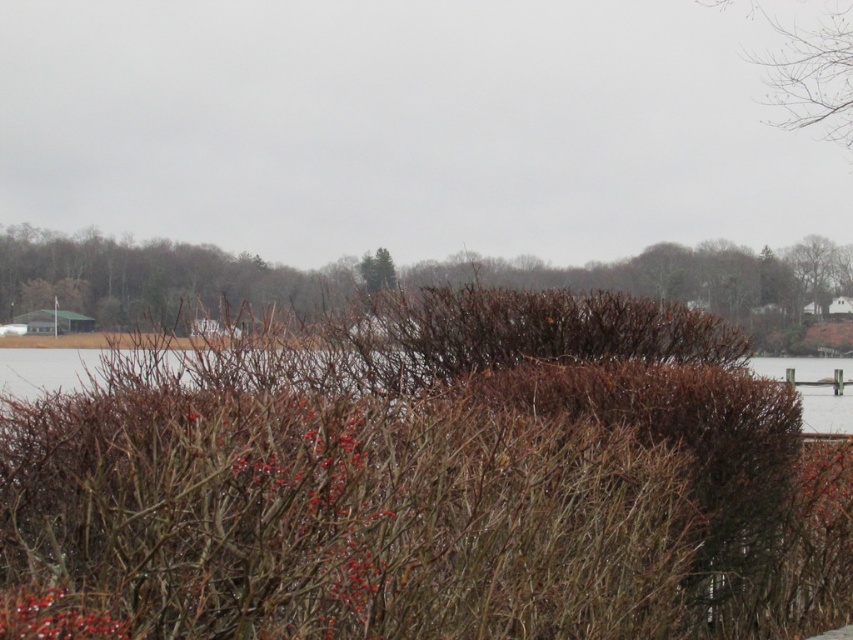
Does brown textured bush at left have a lesser height compared to bare branches at upper right?

Yes.

Which is more to the left, brown textured bush at left or bare branches at upper right?

From the viewer's perspective, brown textured bush at left appears more on the left side.

The width and height of the screenshot is (853, 640). Identify the location of brown textured bush at left. (151, 278).

This screenshot has height=640, width=853. In order to click on brown textured bush at left in this screenshot , I will do 151,278.

Who is higher up, brown textured bush at left or brown textured water at center?

Positioned higher is brown textured bush at left.

Is point (763, 317) in front of point (44, 371)?

No, (763, 317) is further to viewer.

Measure the distance between brown textured bush at left and camera.

They are 9.30 meters apart.

The height and width of the screenshot is (640, 853). I want to click on brown textured bush at left, so click(x=151, y=278).

Which is more to the left, bare branches at upper right or brown textured water at center?

Positioned to the left is brown textured water at center.

Where is `bare branches at upper right`? bare branches at upper right is located at coordinates (811, 74).

At what (x,y) coordinates should I click in order to perform the action: click on bare branches at upper right. Please return your answer as a coordinate pair (x, y). This screenshot has width=853, height=640. Looking at the image, I should click on (811, 74).